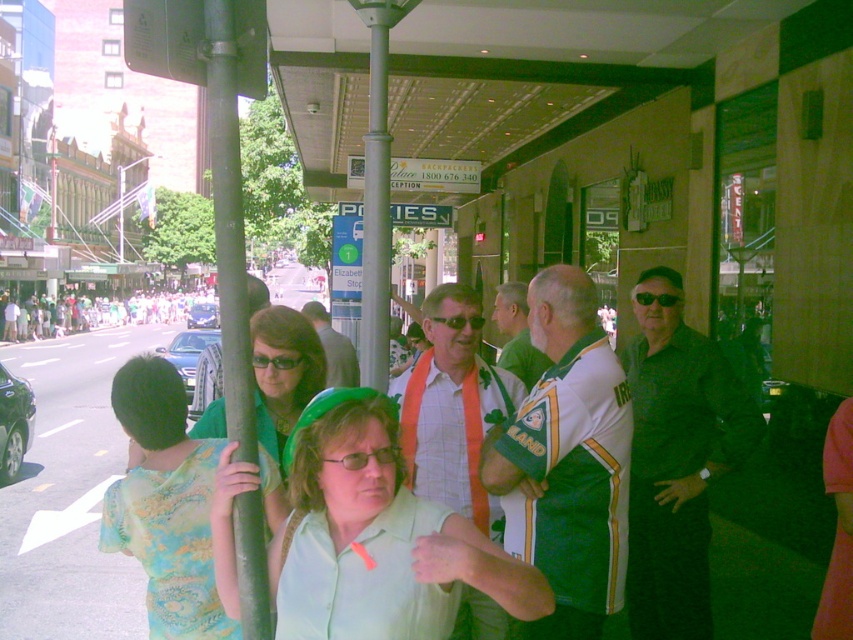
Question: Can you confirm if plaid shirt at center is positioned below green matte pole at left?

Choices:
 (A) yes
 (B) no

Answer: (A)

Question: Which point is farther to the camera?

Choices:
 (A) (669, 294)
 (B) (451, 476)
 (C) (265, 445)

Answer: (A)

Question: Which point is closer to the camera?

Choices:
 (A) (277, 365)
 (B) (384, 449)

Answer: (B)

Question: Can you confirm if green fabric headband at center is smaller than white cotton crowd at center?

Choices:
 (A) no
 (B) yes

Answer: (B)

Question: Which object is the closest to the green fabric shirt at center?

Choices:
 (A) green fabric headband at center
 (B) metallic signboard at upper center
 (C) green jersey at center

Answer: (A)

Question: Is plaid shirt at center bigger than green fabric headband at center?

Choices:
 (A) no
 (B) yes

Answer: (B)